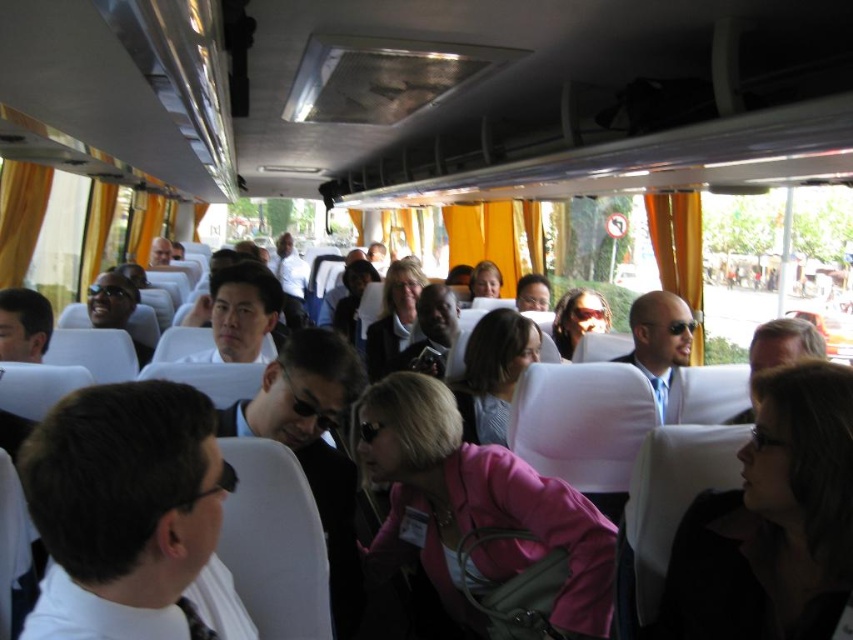
Question: Estimate the real-world distances between objects in this image. Which object is closer to the smooth black suit at center?

Choices:
 (A) light blue suit at center
 (B) pink fabric jacket at center
 (C) pink matte jacket at center
 (D) white shirt at center

Answer: (B)

Question: Which is farther from the matte black sunglasses at center?

Choices:
 (A) pink fabric jacket at lower right
 (B) pink fabric jacket at center
 (C) smooth black suit at center
 (D) pink matte jacket at center

Answer: (A)

Question: Does pink fabric jacket at lower right appear under matte black sunglasses at center?

Choices:
 (A) no
 (B) yes

Answer: (B)

Question: Is white shirt at center to the right of matte black sunglasses at center from the viewer's perspective?

Choices:
 (A) no
 (B) yes

Answer: (A)

Question: Does white shirt at center lie in front of matte black sunglasses at center?

Choices:
 (A) no
 (B) yes

Answer: (B)

Question: Which point appears closest to the camera in this image?

Choices:
 (A) (782, 381)
 (B) (90, 477)

Answer: (B)